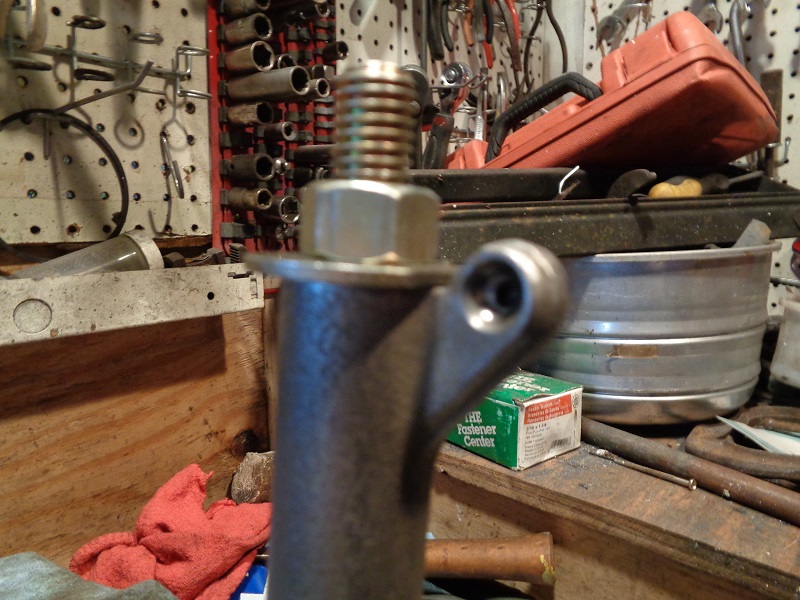
The height and width of the screenshot is (600, 800). Identify the location of jar. (100, 257).